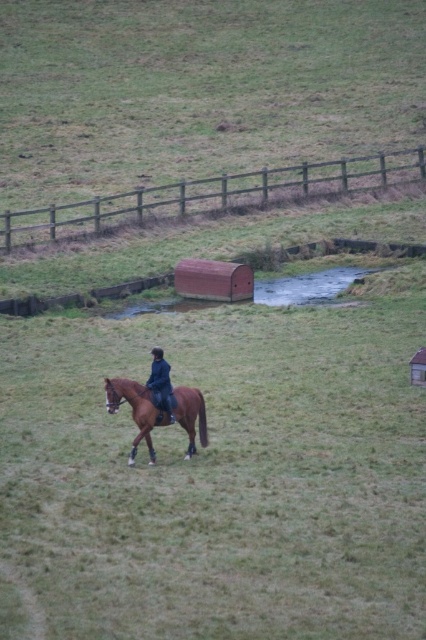
You are standing at the point marked by the coordinates (x=135, y=410) in the image. What object is located at that point?

The point at (x=135, y=410) indicates the brown glossy horse at lower center.

You are a photographer trying to capture a wide shot of the scene. You need to ensure that both the green grassy field at center and the brown glossy horse at lower center are fully visible in your frame. Considering their sizes, which object will require more space in the photo to be fully captured?

The green grassy field at center requires more space in the photo because its width is larger than the brown glossy horse at lower center.